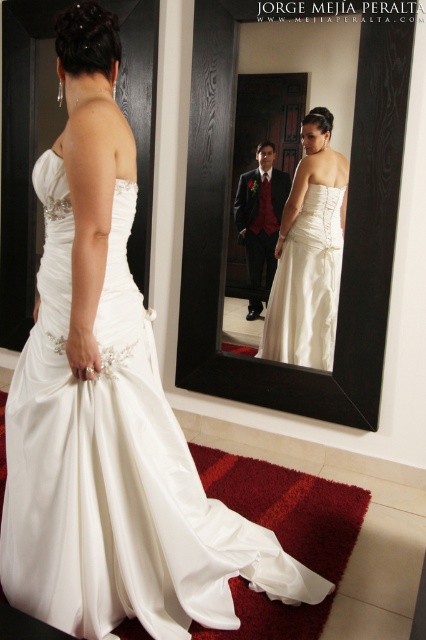
Question: Among these points, which one is farthest from the camera?

Choices:
 (A) (114, 196)
 (B) (203, 32)

Answer: (B)

Question: Does white satin dress at center appear over satin/smooth dress at center?

Choices:
 (A) no
 (B) yes

Answer: (A)

Question: Does white satin dress at center lie behind black frame mirror at center?

Choices:
 (A) no
 (B) yes

Answer: (A)

Question: Which of the following is the closest to the observer?

Choices:
 (A) satin/velvet suit at center
 (B) white satin dress at center
 (C) black frame mirror at center
 (D) satin/smooth dress at center

Answer: (B)

Question: Does satin/smooth dress at center have a lesser width compared to satin/velvet suit at center?

Choices:
 (A) yes
 (B) no

Answer: (B)

Question: Which point appears closest to the camera in this image?

Choices:
 (A) (287, 262)
 (B) (241, 236)

Answer: (A)